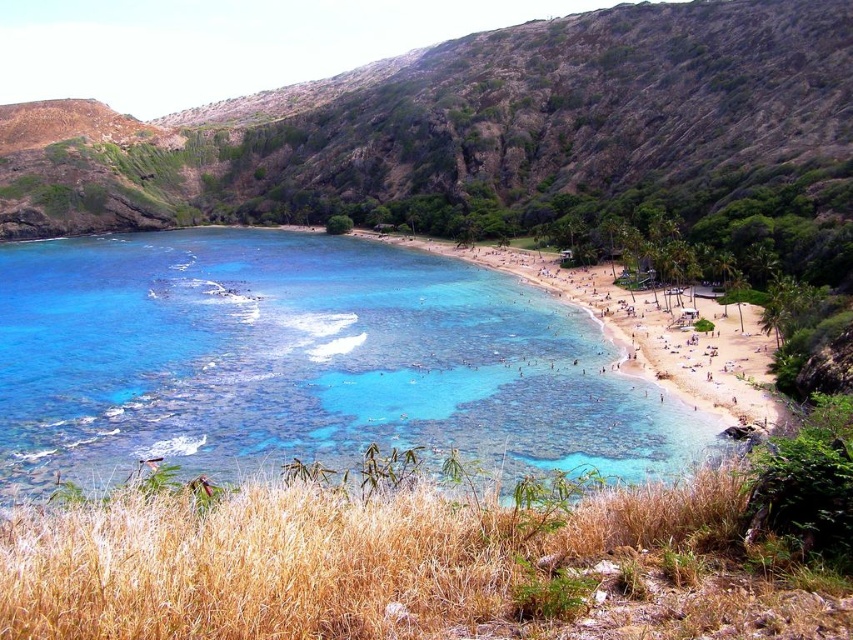
Question: Does clear blue water at center have a lesser width compared to sandy beach at lower right?

Choices:
 (A) yes
 (B) no

Answer: (B)

Question: Is clear blue water at center above sandy beach at lower right?

Choices:
 (A) yes
 (B) no

Answer: (B)

Question: In this image, where is clear blue water at center located relative to sandy beach at lower right?

Choices:
 (A) right
 (B) left

Answer: (B)

Question: Which point appears closest to the camera in this image?

Choices:
 (A) (624, 314)
 (B) (259, 253)

Answer: (A)

Question: Which point is closer to the camera?

Choices:
 (A) (647, 346)
 (B) (97, 470)

Answer: (B)